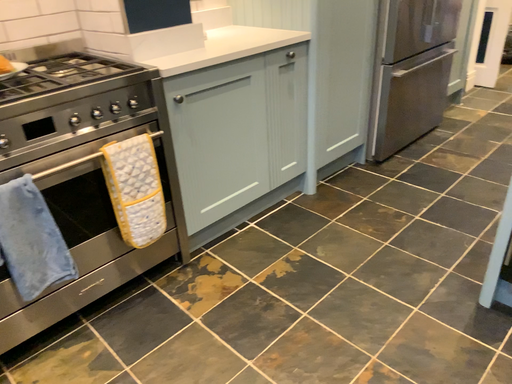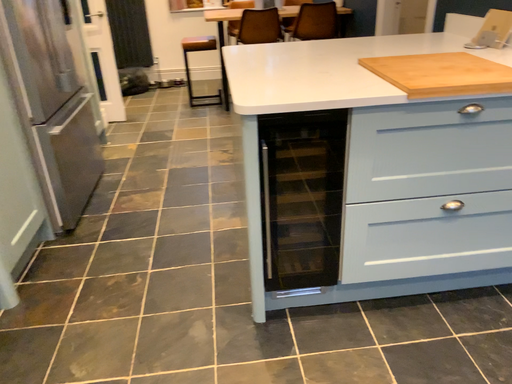
Question: How did the camera likely rotate when shooting the video?

Choices:
 (A) rotated right
 (B) rotated left

Answer: (A)